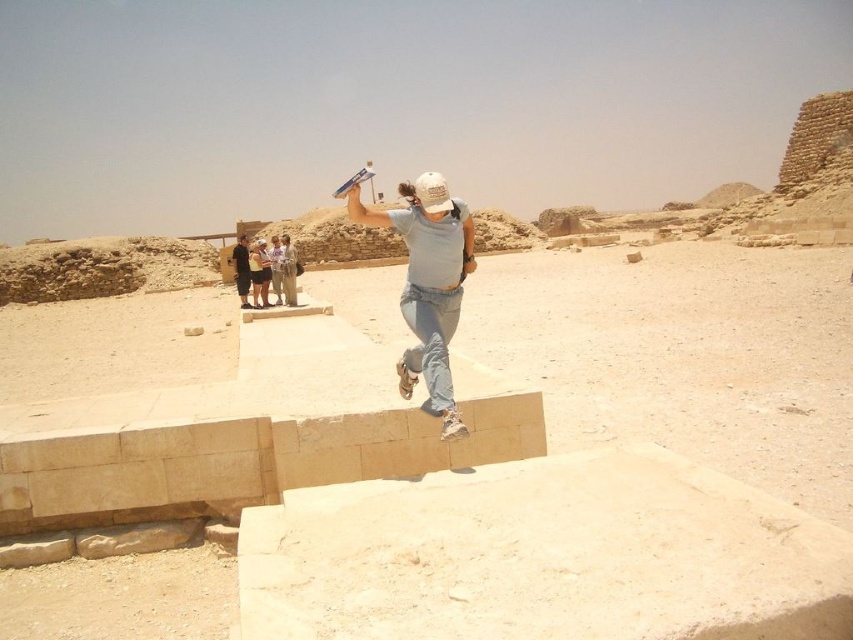
Question: Can you confirm if light blue denim jeans at center is positioned to the left of light brown fabric shirt at center?

Choices:
 (A) no
 (B) yes

Answer: (A)

Question: Is light blue denim jeans at center thinner than light brown fabric shirt at center?

Choices:
 (A) no
 (B) yes

Answer: (A)

Question: Is light blue denim jeans at center to the left of light brown fabric shirt at center from the viewer's perspective?

Choices:
 (A) no
 (B) yes

Answer: (A)

Question: Which of the following is the farthest from the observer?

Choices:
 (A) [424, 202]
 (B) [265, 305]

Answer: (B)

Question: Which point is closer to the camera?

Choices:
 (A) (456, 323)
 (B) (262, 252)

Answer: (A)